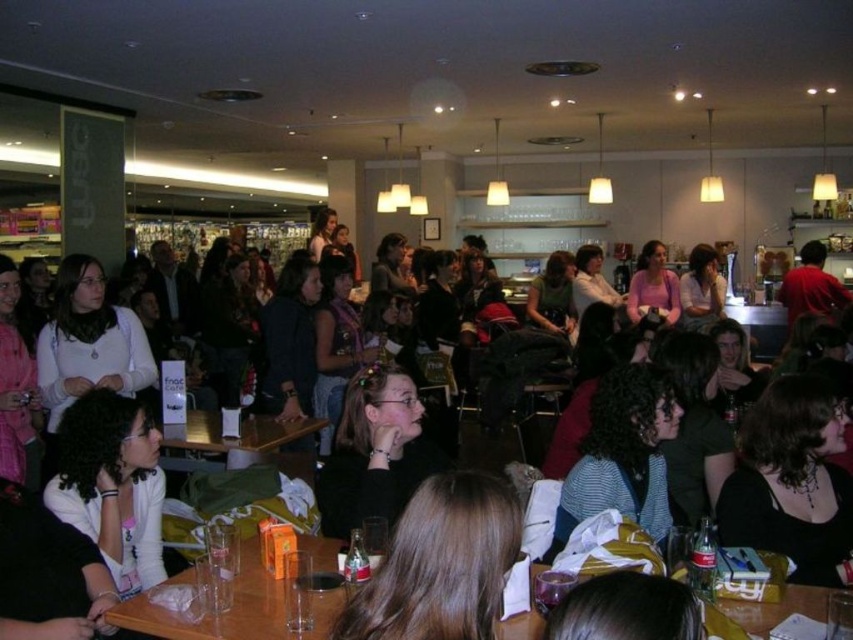
You are a bartender preparing to serve drinks. You notice a striped fabric shirt at center and clear plastic cups at lower center. Which object takes up more horizontal space?

The clear plastic cups at lower center take up more horizontal space than the striped fabric shirt at center because the striped fabric shirt at center has a lesser width compared to clear plastic cups at lower center.

You are sitting at the wooden table at center in the crowded indoor space. You want to hand a napkin to someone wearing the striped fabric shirt at center. Can you reach them without leaving your seat?

The striped fabric shirt at center is in front of the wooden table at center, so you can reach them without leaving your seat.